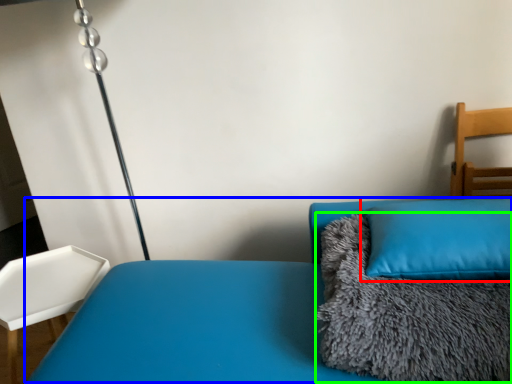
Question: Which object is the farthest from pillow (highlighted by a red box)? Choose among these: couch (highlighted by a blue box) or blanket (highlighted by a green box).

Choices:
 (A) couch
 (B) blanket

Answer: (A)